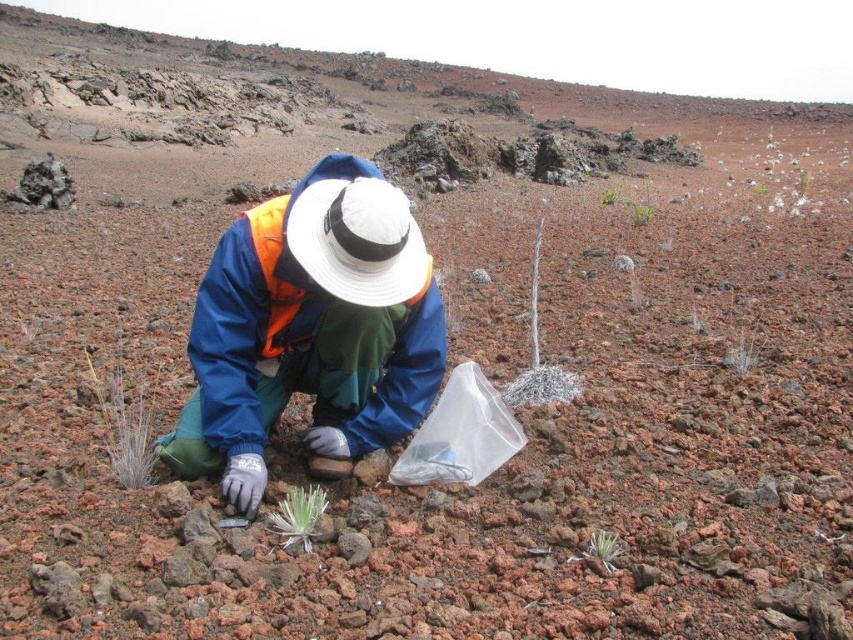
Is white fabric hat at center further to camera compared to green leafy plant at center?

No.

Which is above, white fabric hat at center or green leafy plant at center?

green leafy plant at center is higher up.

Who is more distant from viewer, [428,282] or [614,193]?

The point [614,193] is behind.

This screenshot has width=853, height=640. I want to click on white fabric hat at center, so 358,241.

Which is behind, point (300, 540) or point (621, 198)?

Positioned behind is point (621, 198).

The height and width of the screenshot is (640, 853). What do you see at coordinates (299, 515) in the screenshot?
I see `green fuzzy plant at center` at bounding box center [299, 515].

Where is `green fuzzy plant at center`? Image resolution: width=853 pixels, height=640 pixels. green fuzzy plant at center is located at coordinates (299, 515).

Based on the photo, which is below, silvery grass at lower left or silvery metallic plant at center?

Positioned lower is silvery grass at lower left.

Is silvery grass at lower left wider than silvery metallic plant at center?

Yes, silvery grass at lower left is wider than silvery metallic plant at center.

The height and width of the screenshot is (640, 853). What are the coordinates of `silvery grass at lower left` in the screenshot? It's located at (125, 413).